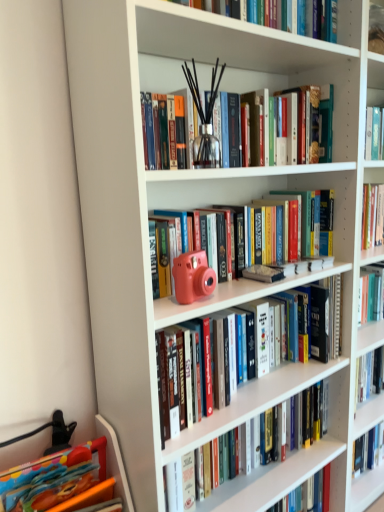
Question: Is multicolored plastic toy at lower left, positioned as the first book in bottom-to-top order, completely or partially outside of matte pink camera at center, positioned as the 3th book in top-to-bottom order?

Choices:
 (A) yes
 (B) no

Answer: (A)

Question: Does multicolored plastic toy at lower left, which is the 6th book in top-to-bottom order, have a greater height compared to matte pink camera at center, positioned as the 3th book in top-to-bottom order?

Choices:
 (A) yes
 (B) no

Answer: (B)

Question: From the image's perspective, is multicolored plastic toy at lower left, positioned as the first book in bottom-to-top order, under matte pink camera at center, which is counted as the fourth book, starting from the bottom?

Choices:
 (A) no
 (B) yes

Answer: (B)

Question: Is multicolored plastic toy at lower left, which is the 6th book in top-to-bottom order, to the right of matte pink camera at center, which is counted as the fourth book, starting from the bottom, from the viewer's perspective?

Choices:
 (A) no
 (B) yes

Answer: (A)

Question: Relative to hardcover book at center, which is counted as the 5th book, starting from the top, is matte pink camera at center, positioned as the 3th book in top-to-bottom order, in front or behind?

Choices:
 (A) behind
 (B) front

Answer: (B)

Question: Is point (206, 208) positioned closer to the camera than point (203, 418)?

Choices:
 (A) farther
 (B) closer

Answer: (A)

Question: Based on their sizes in the image, would you say matte pink camera at center, which is counted as the fourth book, starting from the bottom, is bigger or smaller than hardcover book at center, which is counted as the 5th book, starting from the top?

Choices:
 (A) big
 (B) small

Answer: (B)

Question: From a real-world perspective, is matte pink camera at center, positioned as the 3th book in top-to-bottom order, above or below hardcover book at center, which is counted as the 5th book, starting from the top?

Choices:
 (A) below
 (B) above

Answer: (B)

Question: Is clear glass vase at upper center, which is the 5th book in bottom-to-top order, taller or shorter than matte pink camera at center, which is counted as the fourth book, starting from the bottom?

Choices:
 (A) tall
 (B) short

Answer: (A)

Question: Considering the positions of clear glass vase at upper center, which appears as the second book when viewed from the top, and matte pink camera at center, which is counted as the fourth book, starting from the bottom, in the image, is clear glass vase at upper center, which appears as the second book when viewed from the top, bigger or smaller than matte pink camera at center, which is counted as the fourth book, starting from the bottom,?

Choices:
 (A) big
 (B) small

Answer: (B)

Question: Based on their positions, is clear glass vase at upper center, which appears as the second book when viewed from the top, located to the left or right of matte pink camera at center, which is counted as the fourth book, starting from the bottom?

Choices:
 (A) right
 (B) left

Answer: (B)

Question: From the image's perspective, relative to matte pink camera at center, which is counted as the fourth book, starting from the bottom, is clear glass vase at upper center, which appears as the second book when viewed from the top, above or below?

Choices:
 (A) below
 (B) above

Answer: (B)

Question: Is matte pink camera at center, positioned as the third book in bottom-to-top order, situated inside clear glass vase at upper center, which appears as the second book when viewed from the top, or outside?

Choices:
 (A) inside
 (B) outside

Answer: (B)

Question: Is point (190, 397) positioned closer to the camera than point (311, 132)?

Choices:
 (A) closer
 (B) farther

Answer: (A)